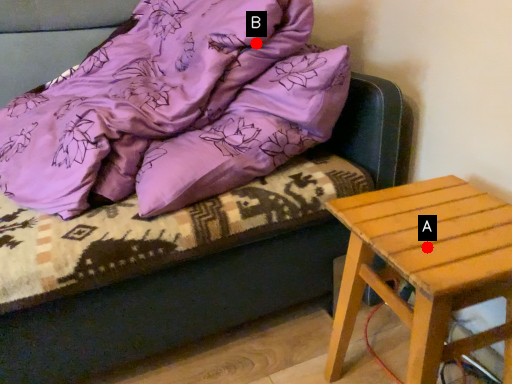
Question: Two points are circled on the image, labeled by A and B beside each circle. Which of the following is the closest to the observer?

Choices:
 (A) A is closer
 (B) B is closer

Answer: (A)